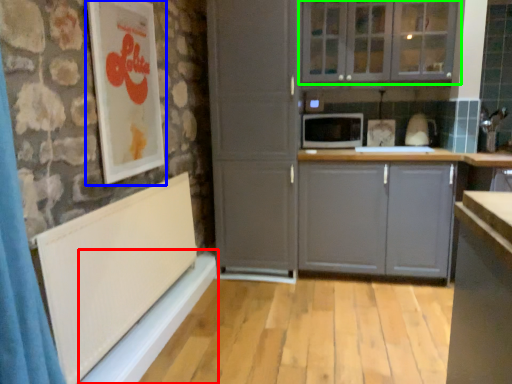
Question: Based on their relative distances, which object is farther from window sill (highlighted by a red box)? Choose from picture frame (highlighted by a blue box) and cabinetry (highlighted by a green box).

Choices:
 (A) picture frame
 (B) cabinetry

Answer: (B)